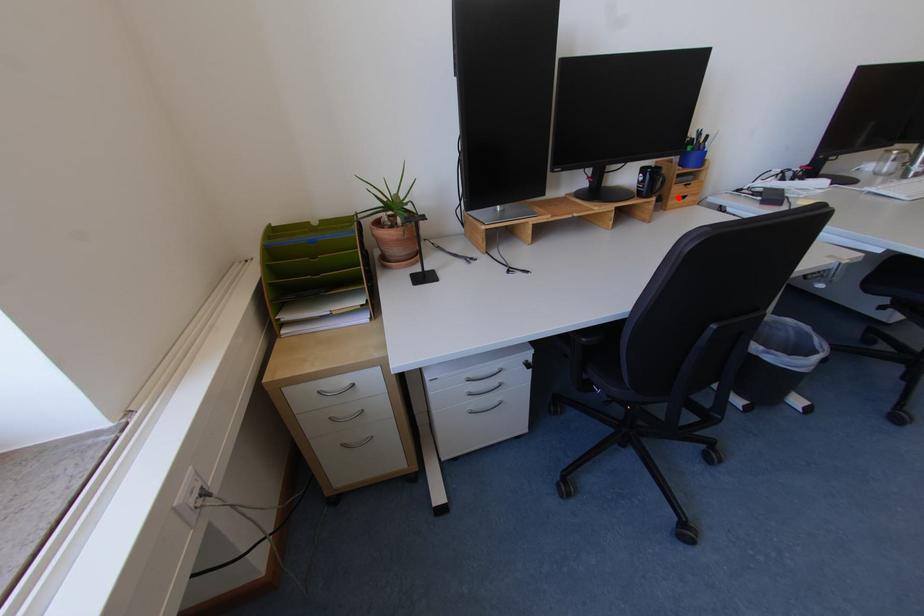
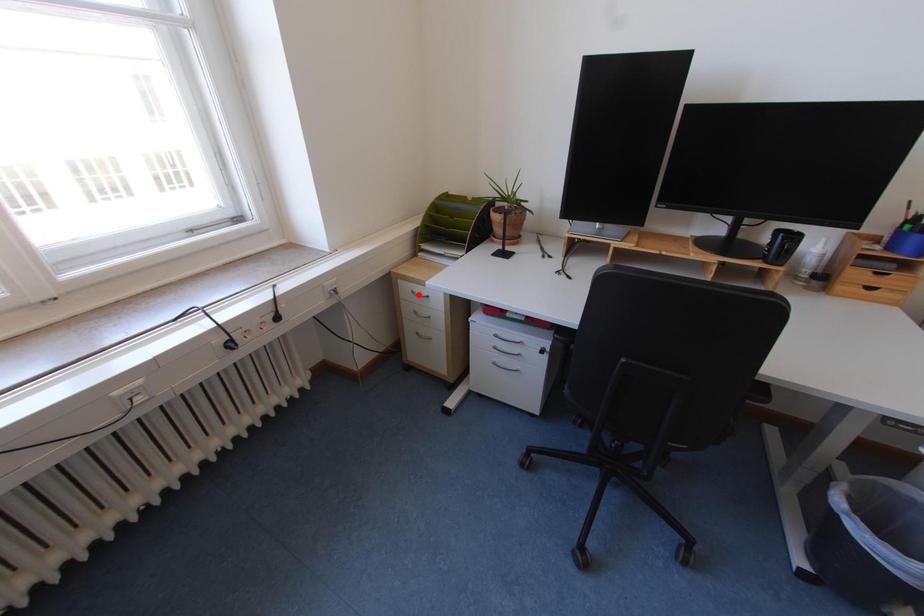
I am providing you with two images of the same scene from different viewpoints. A red point is marked on the first image and another point is marked on the second image. Is the red point in image1 aligned with the point shown in image2?

No